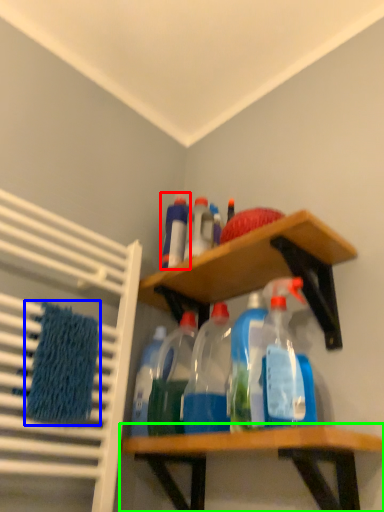
Question: Which object is positioned closest to bottle (highlighted by a red box)? Select from bath towel (highlighted by a blue box) and shelf (highlighted by a green box).

Choices:
 (A) bath towel
 (B) shelf

Answer: (A)